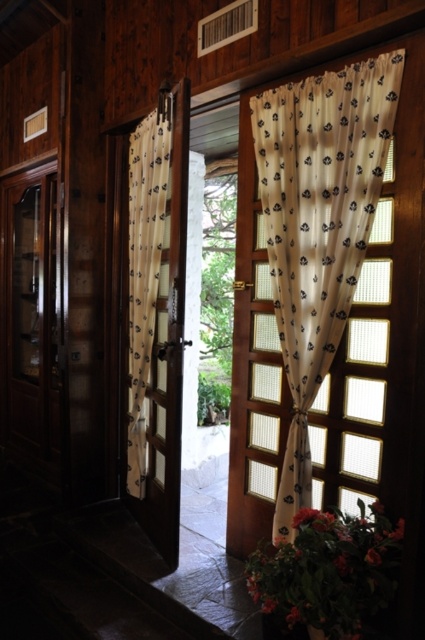
Who is more distant from viewer, (x=255, y=122) or (x=153, y=234)?

Positioned behind is point (x=153, y=234).

Can you confirm if sheer white curtain at right is shorter than white sheer curtain at center?

Indeed, sheer white curtain at right has a lesser height compared to white sheer curtain at center.

Who is more distant from viewer, [291,429] or [170,104]?

Positioned behind is point [170,104].

You are a GUI agent. You are given a task and a screenshot of the screen. Output one action in this format:
    pyautogui.click(x=<x>, y=<y>)
    Task: Click on the sheer white curtain at right
    
    Given the screenshot: What is the action you would take?
    pyautogui.click(x=319, y=227)